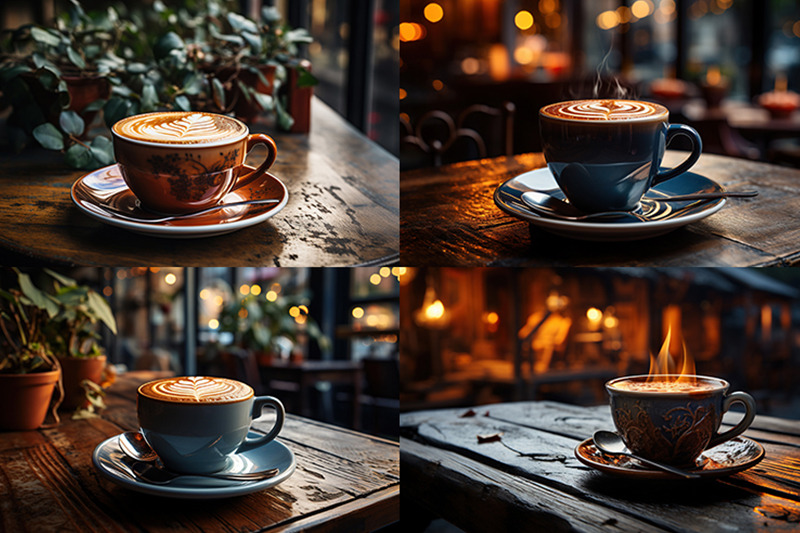
You are a GUI agent. You are given a task and a screenshot of the screen. Output one action in this format:
    pyautogui.click(x=<x>, y=<y>)
    Task: Click on the table
    
    Given the screenshot: What is the action you would take?
    pyautogui.click(x=326, y=235), pyautogui.click(x=477, y=252), pyautogui.click(x=478, y=449), pyautogui.click(x=352, y=466)